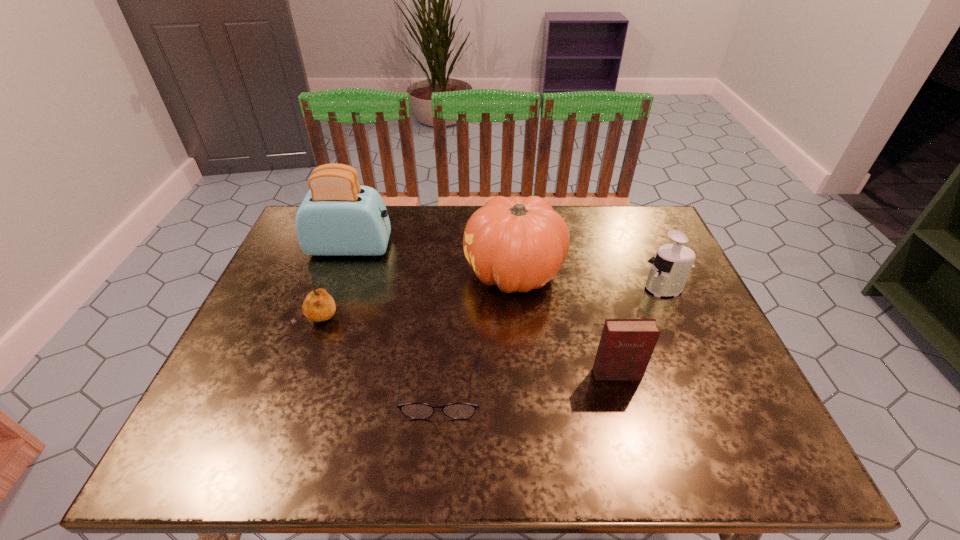
The image size is (960, 540). I want to click on vacant area situated 0.210m on the back of the juicer, so click(x=639, y=233).

The height and width of the screenshot is (540, 960). In order to click on vacant area located on the front cover of the diary in this screenshot , I will do `click(624, 401)`.

I want to click on vacant space located on the front of the fifth tallest object, so click(x=277, y=435).

At what (x,y) coordinates should I click in order to perform the action: click on vacant space located on the front-facing side of the spectacles. Please return your answer as a coordinate pair (x, y). The image size is (960, 540). Looking at the image, I should click on (437, 449).

This screenshot has height=540, width=960. What are the coordinates of `toaster at the far edge` in the screenshot? It's located at click(338, 217).

At what (x,y) coordinates should I click in order to perform the action: click on pumpkin at the far edge. Please return your answer as a coordinate pair (x, y). The height and width of the screenshot is (540, 960). Looking at the image, I should click on (518, 244).

In order to click on toaster at the left edge in this screenshot , I will do `click(338, 217)`.

Image resolution: width=960 pixels, height=540 pixels. In order to click on pear that is at the left edge in this screenshot , I will do click(x=318, y=305).

Where is `object located in the right edge section of the desktop`? Image resolution: width=960 pixels, height=540 pixels. object located in the right edge section of the desktop is located at coordinates [670, 269].

Where is `object at the far left corner`? object at the far left corner is located at coordinates (338, 217).